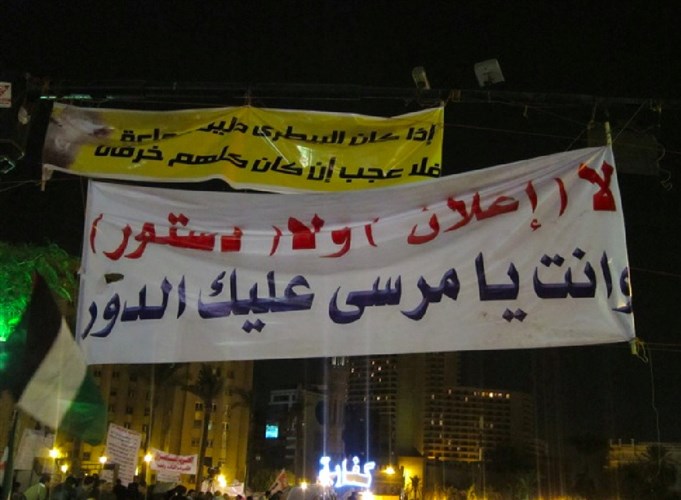
Image resolution: width=681 pixels, height=500 pixels. In order to click on digital screen in this screenshot , I will do `click(270, 432)`.